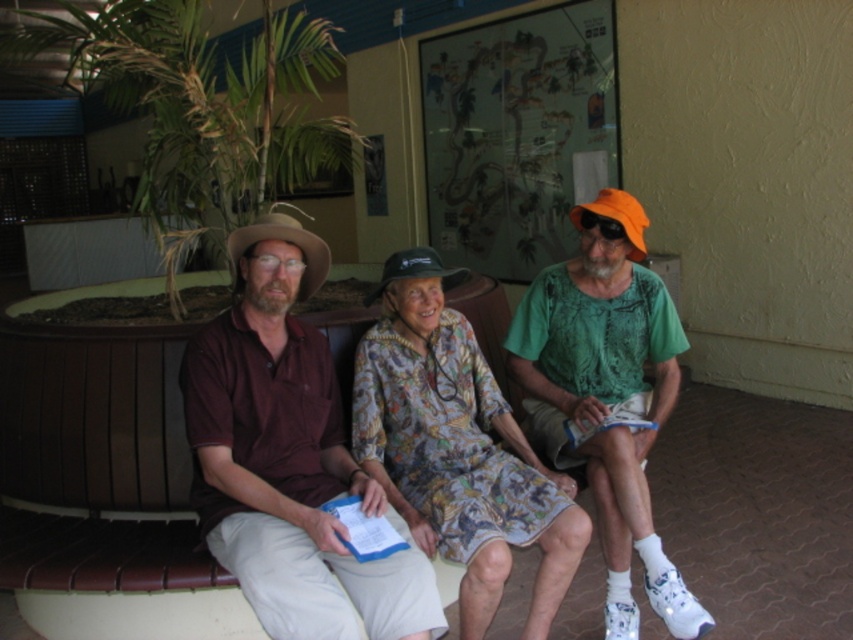
Which is above, printed fabric dress at center or floral fabric dress at center?

printed fabric dress at center is above.

Based on the photo, is printed fabric dress at center smaller than floral fabric dress at center?

Incorrect, printed fabric dress at center is not smaller in size than floral fabric dress at center.

Is point (508, 419) positioned after point (444, 436)?

Yes, it is.

Where is `printed fabric dress at center`? This screenshot has height=640, width=853. printed fabric dress at center is located at coordinates (607, 396).

Does printed fabric dress at center have a lesser width compared to brown felt cowboy hat at left?

No, printed fabric dress at center is not thinner than brown felt cowboy hat at left.

Between point (614, 390) and point (279, 221), which one is positioned in front?

Positioned in front is point (279, 221).

Locate an element on the screen. printed fabric dress at center is located at coordinates (607, 396).

Is floral fabric dress at center to the left of brown felt cowboy hat at left from the viewer's perspective?

In fact, floral fabric dress at center is to the right of brown felt cowboy hat at left.

Measure the distance from floral fabric dress at center to brown felt cowboy hat at left.

23.51 inches

Is point (489, 532) positioned before point (306, 294)?

Yes.

Identify the location of floral fabric dress at center. The image size is (853, 640). (456, 448).